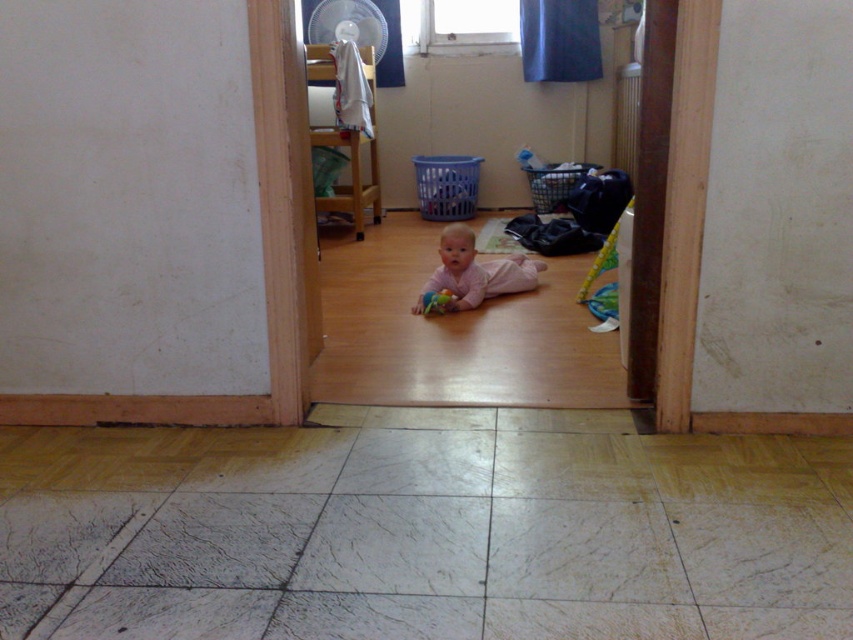
Who is taller, blue plastic laundry basket at center or white fabric at upper center?

blue plastic laundry basket at center is taller.

What do you see at coordinates (445, 186) in the screenshot? This screenshot has width=853, height=640. I see `blue plastic laundry basket at center` at bounding box center [445, 186].

At what (x,y) coordinates should I click in order to perform the action: click on blue plastic laundry basket at center. Please return your answer as a coordinate pair (x, y). Looking at the image, I should click on (445, 186).

Can you confirm if blue plastic laundry basket at center is positioned below blue plastic laundry basket at center right?

Indeed, blue plastic laundry basket at center is positioned under blue plastic laundry basket at center right.

Between point (457, 189) and point (538, 195), which one is positioned in front?

Positioned in front is point (538, 195).

Between point (445, 209) and point (552, 188), which one is positioned in front?

Positioned in front is point (552, 188).

Locate an element on the screen. This screenshot has width=853, height=640. blue plastic laundry basket at center is located at coordinates (445, 186).

Which is more to the left, pink fabric baby at center or rubberized plastic toy at center?

rubberized plastic toy at center is more to the left.

Describe the element at coordinates (474, 273) in the screenshot. This screenshot has width=853, height=640. I see `pink fabric baby at center` at that location.

The width and height of the screenshot is (853, 640). Find the location of `pink fabric baby at center`. pink fabric baby at center is located at coordinates (474, 273).